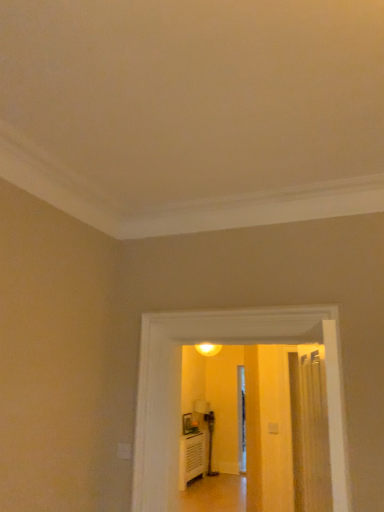
Question: Is wooden floor at lower center wider or thinner than smooth beige carpet at center?

Choices:
 (A) wide
 (B) thin

Answer: (A)

Question: Considering the positions of point (223, 500) and point (273, 320), is point (223, 500) closer or farther from the camera than point (273, 320)?

Choices:
 (A) closer
 (B) farther

Answer: (B)

Question: Looking at the image, does wooden floor at lower center seem bigger or smaller compared to smooth beige carpet at center?

Choices:
 (A) big
 (B) small

Answer: (B)

Question: Is smooth beige carpet at center inside the boundaries of wooden floor at lower center, or outside?

Choices:
 (A) inside
 (B) outside

Answer: (B)

Question: From the image's perspective, is smooth beige carpet at center above or below wooden floor at lower center?

Choices:
 (A) above
 (B) below

Answer: (A)

Question: Looking at the image, does smooth beige carpet at center seem bigger or smaller compared to wooden floor at lower center?

Choices:
 (A) big
 (B) small

Answer: (A)

Question: From a real-world perspective, is smooth beige carpet at center positioned above or below wooden floor at lower center?

Choices:
 (A) below
 (B) above

Answer: (B)